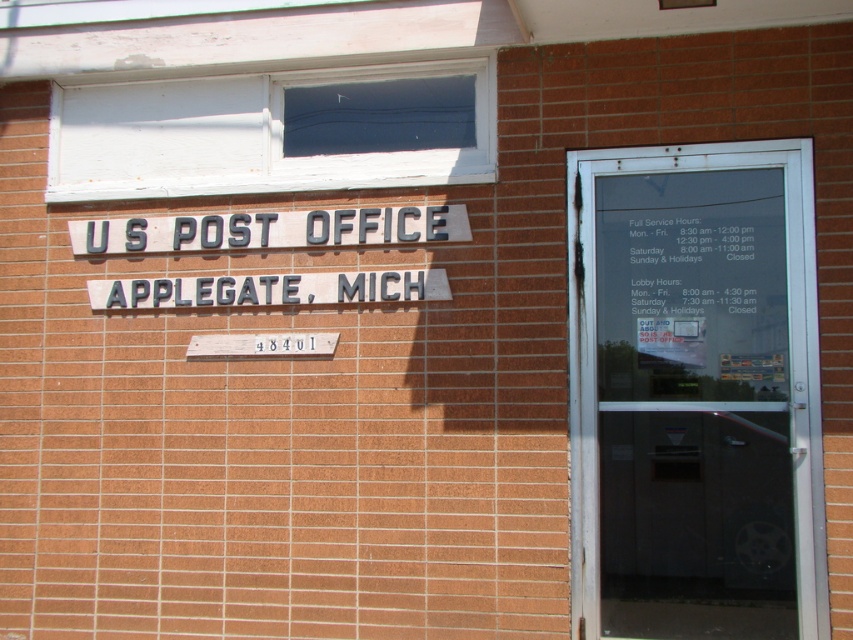
Between transparent glass door at center and white painted wood window at upper center, which one appears on the right side from the viewer's perspective?

From the viewer's perspective, transparent glass door at center appears more on the right side.

Between transparent glass door at center and white painted wood window at upper center, which one is positioned higher?

white painted wood window at upper center

Is point (740, 243) farther from viewer compared to point (236, 106)?

That is False.

I want to click on transparent glass door at center, so click(x=695, y=392).

Who is shorter, white painted wood window at upper center or gray metallic sign at upper center?

Standing shorter between the two is gray metallic sign at upper center.

Is white painted wood window at upper center closer to the viewer compared to gray metallic sign at upper center?

No.

Is point (314, 140) farther from viewer compared to point (393, 291)?

That is True.

Where is `white painted wood window at upper center`? This screenshot has height=640, width=853. white painted wood window at upper center is located at coordinates (x=274, y=131).

Describe the element at coordinates (695, 392) in the screenshot. This screenshot has height=640, width=853. I see `transparent glass door at center` at that location.

Does point (717, 333) come behind point (416, 218)?

No, it is not.

The height and width of the screenshot is (640, 853). Find the location of `transparent glass door at center`. transparent glass door at center is located at coordinates (695, 392).